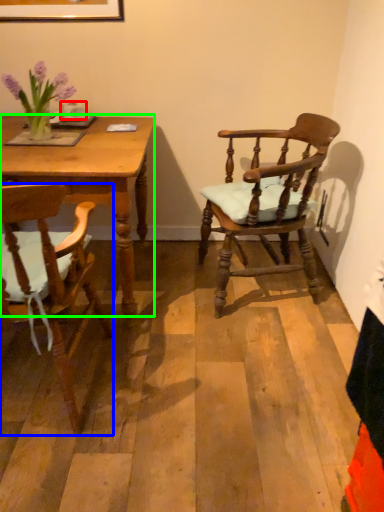
Question: Which object is positioned farthest from coffee cup (highlighted by a red box)? Select from chair (highlighted by a blue box) and desk (highlighted by a green box).

Choices:
 (A) chair
 (B) desk

Answer: (A)